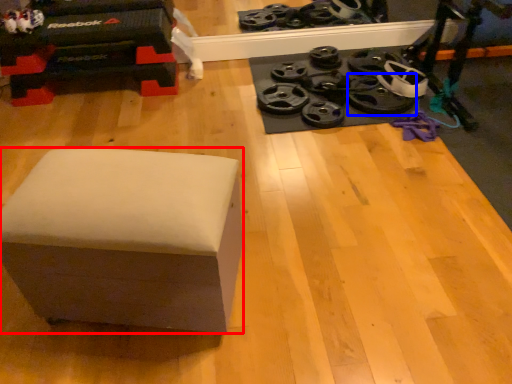
Question: Which point is closer to the camera, furniture (highlighted by a red box) or wheel (highlighted by a blue box)?

Choices:
 (A) furniture
 (B) wheel

Answer: (A)